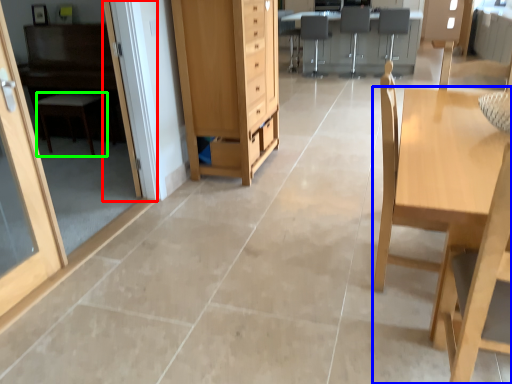
Question: Which object is positioned farthest from screen door (highlighted by a red box)? Select from table (highlighted by a blue box) and furniture (highlighted by a green box).

Choices:
 (A) table
 (B) furniture

Answer: (A)